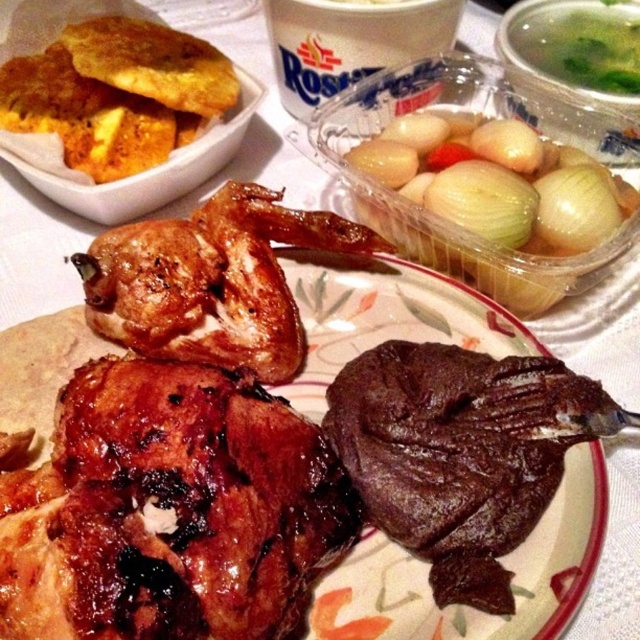
Is point (484, 493) farther from viewer compared to point (524, 161)?

No, (484, 493) is in front of (524, 161).

Is dark brown crispy meat at center wider than translucent plastic container at upper right?

No.

Which is in front, point (538, 496) or point (556, 273)?

Positioned in front is point (538, 496).

Locate an element on the screen. The image size is (640, 640). dark brown crispy meat at center is located at coordinates (461, 452).

The image size is (640, 640). What do you see at coordinates (492, 202) in the screenshot? I see `translucent plastic container at upper right` at bounding box center [492, 202].

Is translucent plastic container at upper right positioned before golden fried patacones at upper left?

Yes, it is.

The height and width of the screenshot is (640, 640). Identify the location of translucent plastic container at upper right. (492, 202).

In order to click on translucent plastic container at upper right in this screenshot , I will do `click(492, 202)`.

Can you confirm if dark brown crispy meat at center is thinner than brown crispy chicken at center?

Correct, dark brown crispy meat at center's width is less than brown crispy chicken at center's.

Who is more forward, (387,470) or (244,227)?

Point (387,470)

Locate an element on the screen. dark brown crispy meat at center is located at coordinates (461, 452).